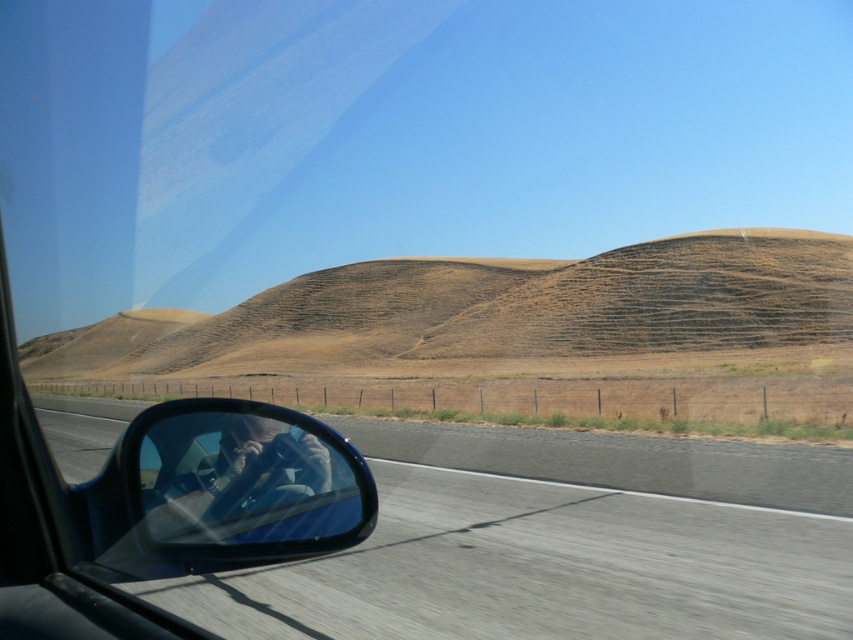
Can you confirm if smooth asphalt highway at center is thinner than clear plastic side mirror at lower left?

Incorrect, smooth asphalt highway at center's width is not less than clear plastic side mirror at lower left's.

In the scene shown: Between smooth asphalt highway at center and clear plastic side mirror at lower left, which one has more height?

With more height is clear plastic side mirror at lower left.

Is point (424, 605) less distant than point (276, 432)?

Yes, point (424, 605) is in front of point (276, 432).

This screenshot has height=640, width=853. Find the location of `smooth asphalt highway at center`. smooth asphalt highway at center is located at coordinates (548, 552).